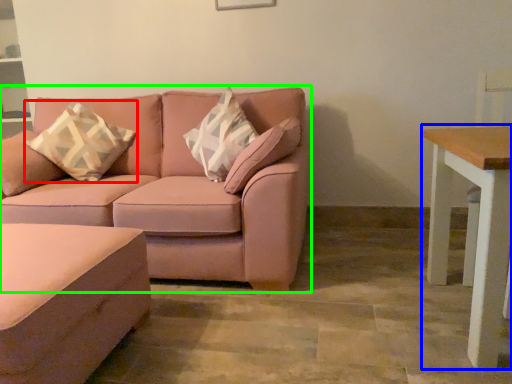
Question: Which object is the closest to the throw pillow (highlighted by a red box)? Choose among these: table (highlighted by a blue box) or studio couch (highlighted by a green box).

Choices:
 (A) table
 (B) studio couch

Answer: (B)